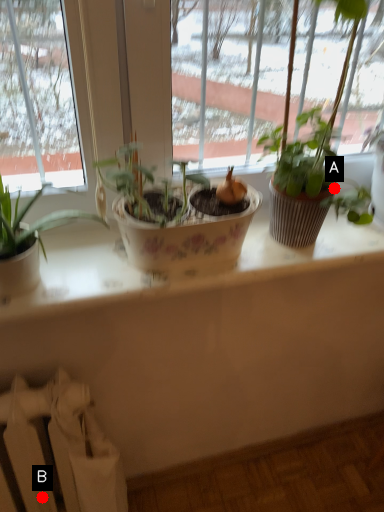
Question: Two points are circled on the image, labeled by A and B beside each circle. Which point appears closest to the camera in this image?

Choices:
 (A) A is closer
 (B) B is closer

Answer: (A)